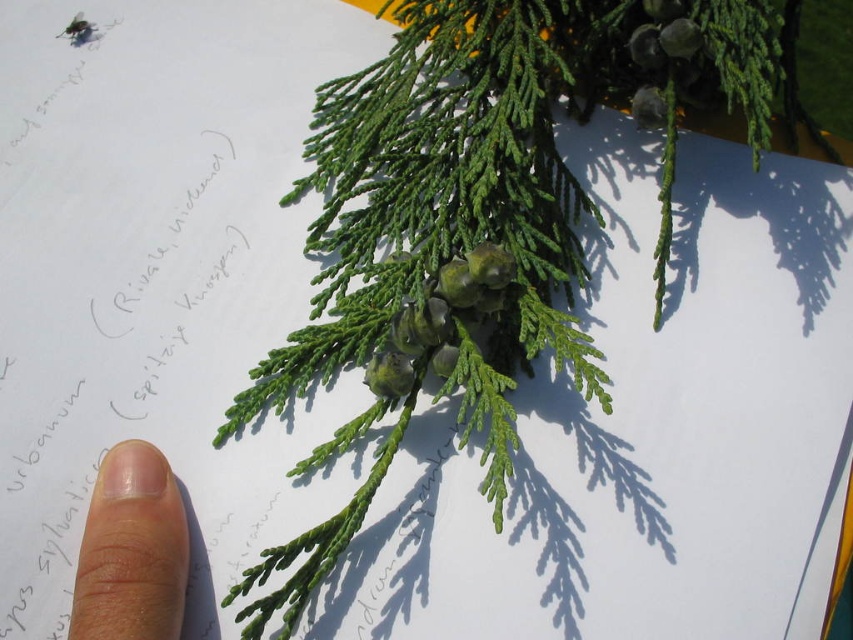
Question: Among these points, which one is farthest from the camera?

Choices:
 (A) (384, 454)
 (B) (177, 573)

Answer: (A)

Question: Is green textured branch at center to the left of flesh-toned skin at lower left from the viewer's perspective?

Choices:
 (A) yes
 (B) no

Answer: (B)

Question: Which object is closer to the camera taking this photo?

Choices:
 (A) flesh-toned skin at lower left
 (B) green textured branch at center

Answer: (A)

Question: Is green textured branch at center smaller than flesh-toned skin at lower left?

Choices:
 (A) yes
 (B) no

Answer: (B)

Question: Is green textured branch at center wider than flesh-toned skin at lower left?

Choices:
 (A) yes
 (B) no

Answer: (A)